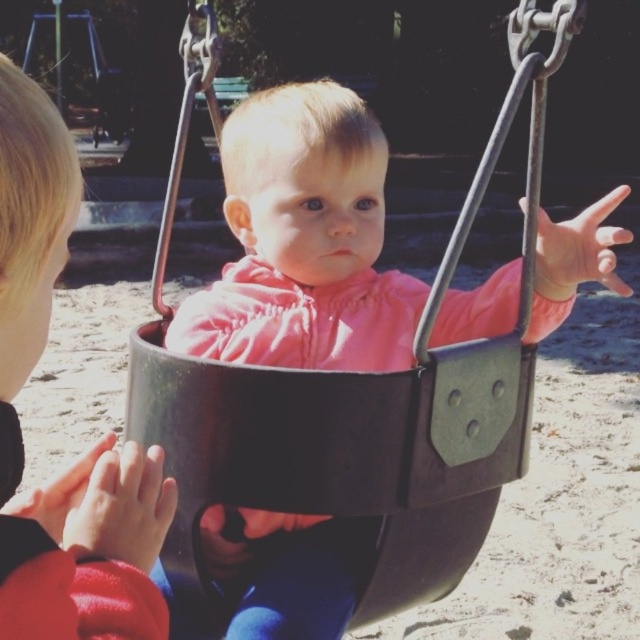
Question: Does black matte swing at center appear on the left side of matte black swing at center?

Choices:
 (A) no
 (B) yes

Answer: (A)

Question: Is black matte swing at center above matte black swing at center?

Choices:
 (A) yes
 (B) no

Answer: (A)

Question: Which point is farther from the camera taking this photo?

Choices:
 (A) (378, 598)
 (B) (76, 602)

Answer: (A)

Question: Does black matte swing at center appear on the right side of matte black swing at center?

Choices:
 (A) yes
 (B) no

Answer: (A)